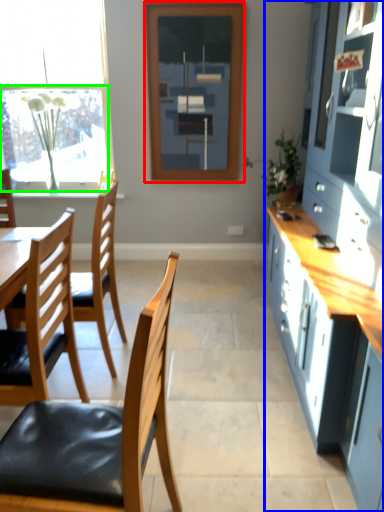
Question: Considering the real-world distances, which object is farthest from window frame (highlighted by a red box)? cabinetry (highlighted by a blue box) or window screen (highlighted by a green box)?

Choices:
 (A) cabinetry
 (B) window screen

Answer: (A)